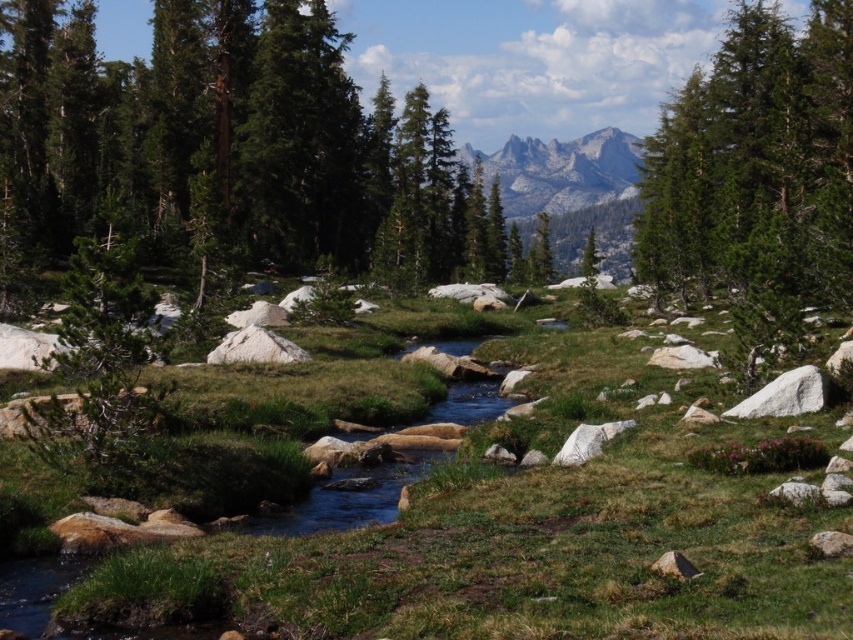
Which is in front, point (741, 45) or point (566, 150)?

Positioned in front is point (741, 45).

At what (x,y) coordinates should I click in order to perform the action: click on green textured tree at upper right. Please return your answer as a coordinate pair (x, y). Image resolution: width=853 pixels, height=640 pixels. Looking at the image, I should click on (x=755, y=163).